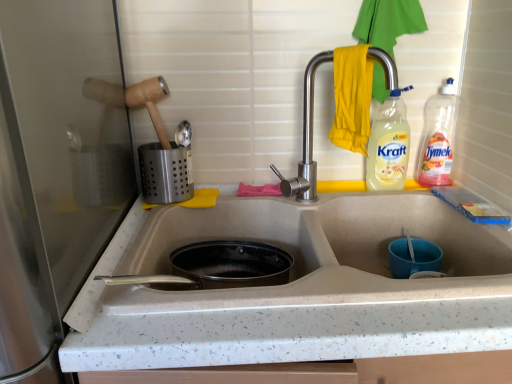
Question: Considering their positions, is translucent plastic bottle at upper right, the second bottle in the right-to-left sequence, located in front of or behind yellow fabric hand towel at upper right?

Choices:
 (A) behind
 (B) front

Answer: (A)

Question: Is translucent plastic bottle at upper right, the second bottle in the right-to-left sequence, spatially inside yellow fabric hand towel at upper right, or outside of it?

Choices:
 (A) inside
 (B) outside

Answer: (B)

Question: Considering the real-world distances, which object is closest to the satin silver utensil holder at upper left, arranged as the first appliance when viewed from the right?

Choices:
 (A) yellow fabric hand towel at upper right
 (B) clear plastic bottle at upper right, which is the second bottle from left to right
 (C) translucent plastic bottle at upper right, the second bottle in the right-to-left sequence
 (D) white speckled countertop at left, which appears as the 2th appliance when viewed from the right
 (E) white speckled stone sink at center

Answer: (E)

Question: Considering the real-world distances, which object is closest to the satin silver utensil holder at upper left, arranged as the first appliance when viewed from the right?

Choices:
 (A) satin nickel faucet at center
 (B) yellow fabric hand towel at upper right
 (C) translucent plastic bottle at upper right, the second bottle in the right-to-left sequence
 (D) white speckled countertop at left, the first appliance when ordered from bottom to top
 (E) white speckled stone sink at center

Answer: (E)